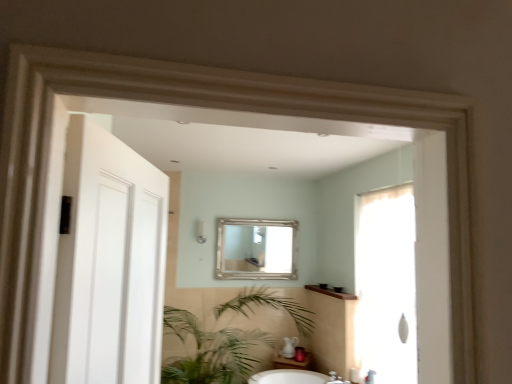
Find the location of `vacant area on top of silver metallic mirror at center (from a real-world perspective)`. vacant area on top of silver metallic mirror at center (from a real-world perspective) is located at coordinates (260, 222).